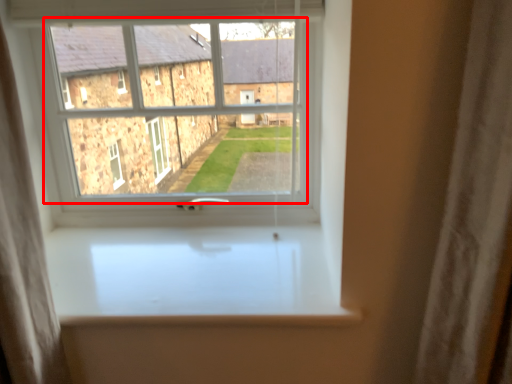
Question: From the image's perspective, where is bay window (annotated by the red box) located in relation to window sill in the image?

Choices:
 (A) above
 (B) below

Answer: (A)